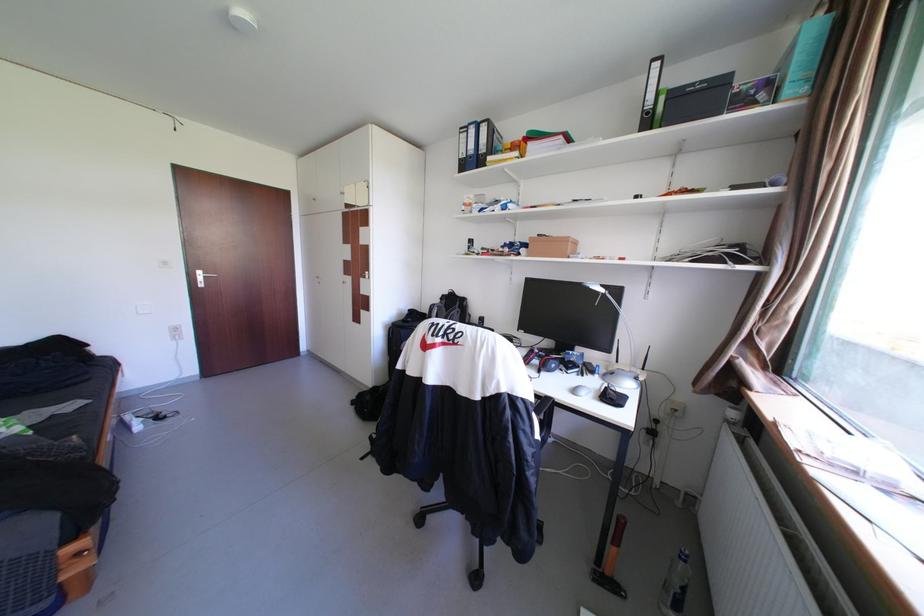
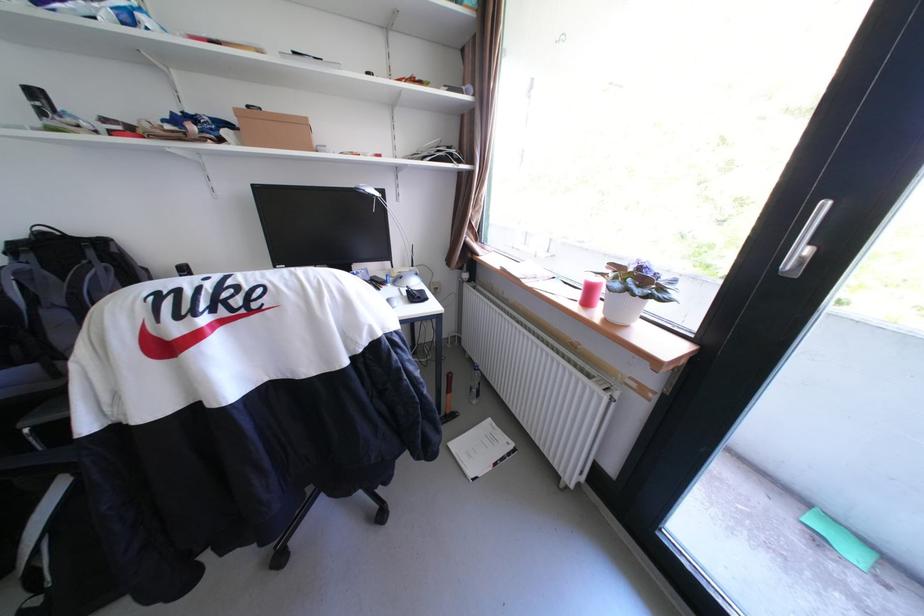
Locate, in the second image, the point that corresponds to (541,238) in the first image.

(247, 111)